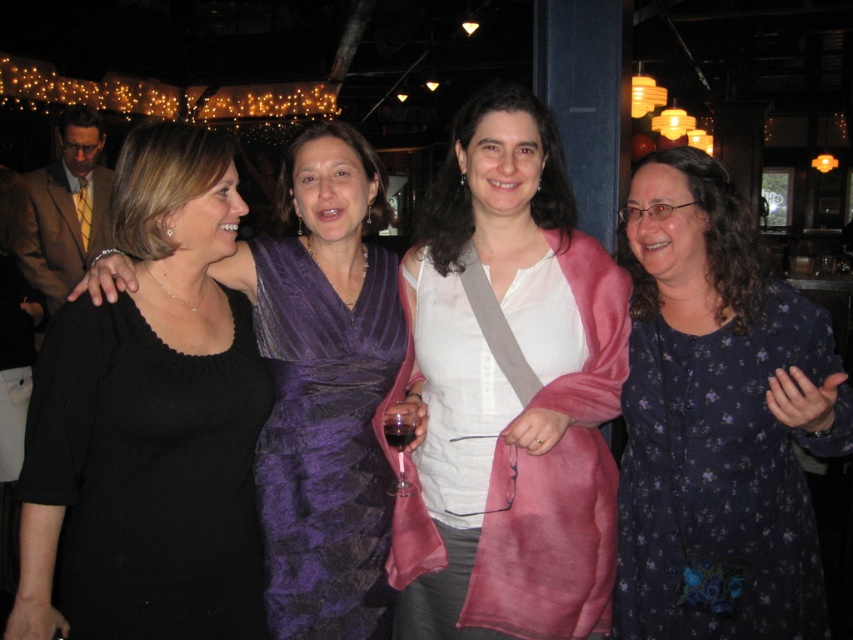
Who is taller, white silk scarf at center or transparent glass at center?

white silk scarf at center is taller.

Is point (570, 536) farther from viewer compared to point (405, 480)?

That is False.

Where is `white silk scarf at center`? white silk scarf at center is located at coordinates (508, 392).

Is point (335, 611) closer to viewer compared to point (399, 426)?

No.

Does purple satin dress at center come in front of dark red glass at center?

No, it is not.

Image resolution: width=853 pixels, height=640 pixels. Identify the location of purple satin dress at center. (325, 442).

Find the location of a particular element. purple satin dress at center is located at coordinates (325, 442).

Can you confirm if velvet purple dress at center is smaller than transparent glass at center?

Incorrect, velvet purple dress at center is not smaller in size than transparent glass at center.

Identify the location of velvet purple dress at center. (325, 388).

Is point (335, 333) closer to camera compared to point (399, 435)?

No, it is not.

Where is `velvet purple dress at center`? This screenshot has width=853, height=640. velvet purple dress at center is located at coordinates (325, 388).